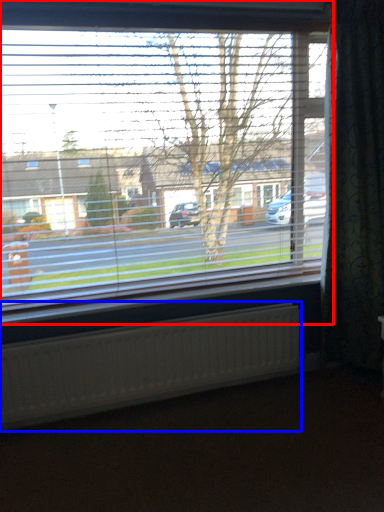
Question: Among these objects, which one is nearest to the camera, window (highlighted by a red box) or radiator (highlighted by a blue box)?

Choices:
 (A) window
 (B) radiator

Answer: (A)